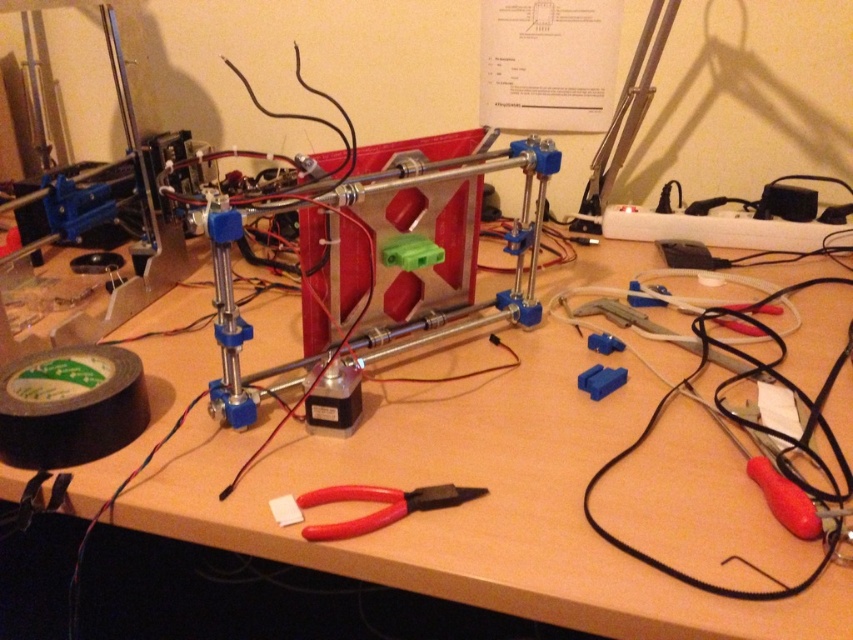
In the scene shown: Can you confirm if wooden table at center is positioned below red plastic pliers at center?

Incorrect, wooden table at center is not positioned below red plastic pliers at center.

Is wooden table at center above red plastic pliers at center?

Correct, wooden table at center is located above red plastic pliers at center.

Identify the location of wooden table at center. Image resolution: width=853 pixels, height=640 pixels. (431, 513).

Find the location of a particular element. Image resolution: width=853 pixels, height=640 pixels. wooden table at center is located at coordinates (431, 513).